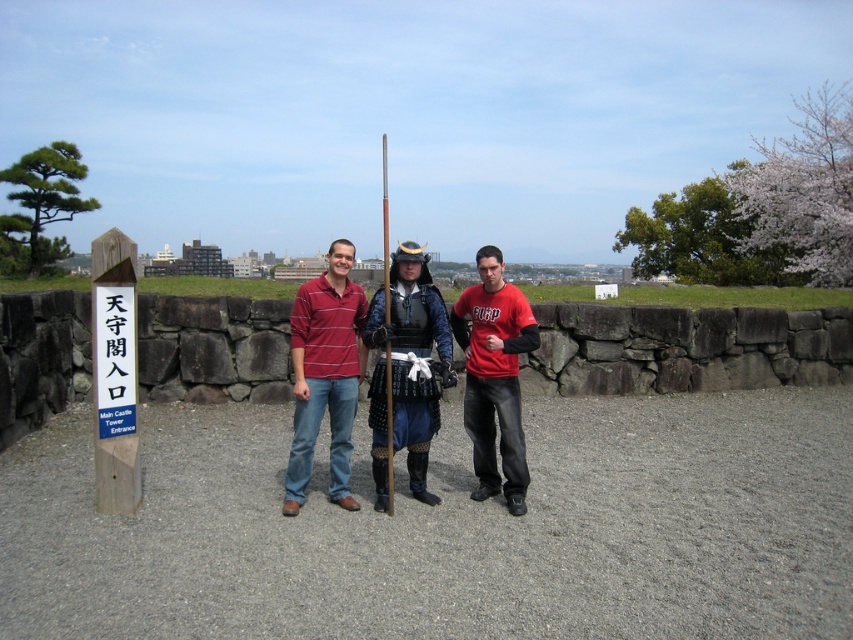
In the scene shown: You are a tour guide at the historical site and need to describe the positioning of the striped cotton polo shirt at center and the black textured armor at center to visitors. Based on the scene, which object is positioned lower?

The striped cotton polo shirt at center is positioned below the black textured armor at center, so it is lower.

What is the location of the point with coordinates (x=410, y=310) in the image?

The point with coordinates (x=410, y=310) is located on the matte black armor at center.